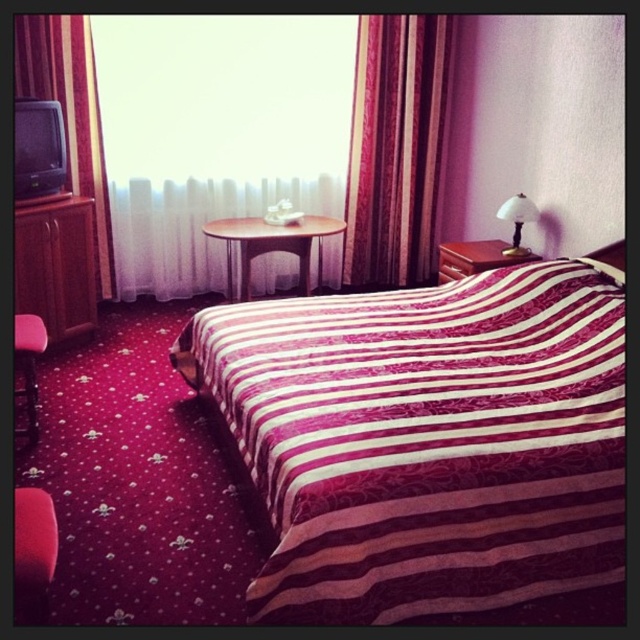
Question: Which point is farther to the camera?

Choices:
 (A) (528, 204)
 (B) (276, 160)
 (C) (29, 529)

Answer: (B)

Question: Considering the relative positions of matte wood nightstand at right and matte black lamp at upper right in the image provided, where is matte wood nightstand at right located with respect to matte black lamp at upper right?

Choices:
 (A) right
 (B) left

Answer: (B)

Question: Which of the following is the farthest from the observer?

Choices:
 (A) (38, 522)
 (B) (323, 438)

Answer: (B)

Question: Which point is farther to the camera?

Choices:
 (A) wooden table at center
 (B) velvet red armchair at lower left
 (C) matte wood nightstand at right

Answer: (A)

Question: Does velvet-like burgundy curtain at upper center have a greater width compared to velvet-like burgundy curtain at left?

Choices:
 (A) no
 (B) yes

Answer: (B)

Question: Can you confirm if striped fabric bed at center is wider than velvet pink armchair at lower left?

Choices:
 (A) yes
 (B) no

Answer: (A)